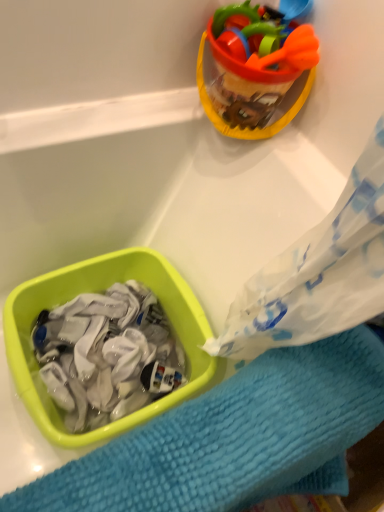
Describe the element at coordinates (234, 438) in the screenshot. I see `blue textured towel at lower center` at that location.

Where is `blue textured towel at lower center`? blue textured towel at lower center is located at coordinates (234, 438).

Where is `blue textured towel at lower center`? This screenshot has height=512, width=384. blue textured towel at lower center is located at coordinates (234, 438).